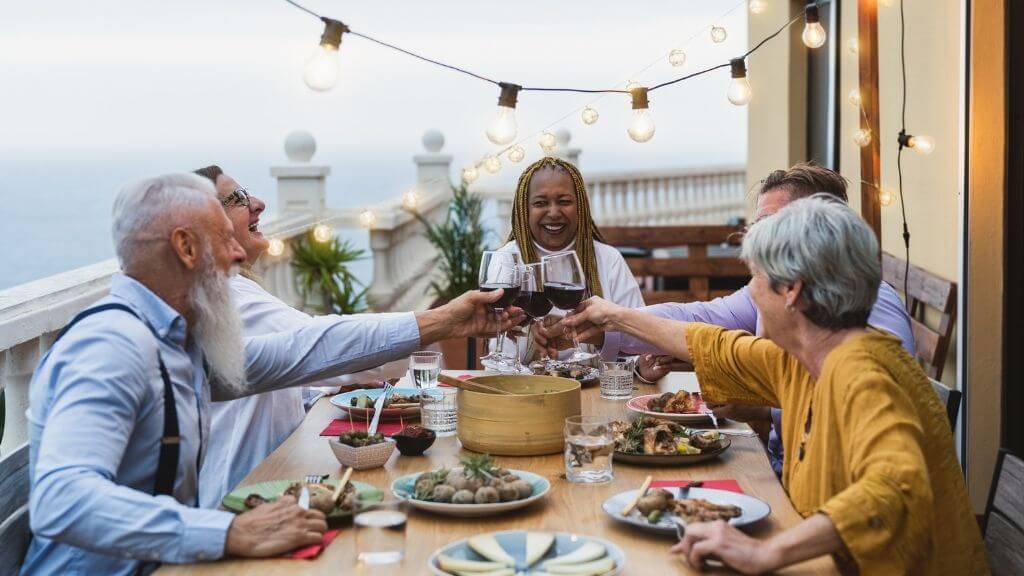
At what (x,y) coordinates should I click in order to perform the action: click on 5 people around the table. Please return your answer as a coordinate pair (x, y). Looking at the image, I should click on (162, 339), (263, 308), (544, 230), (796, 187), (831, 293).